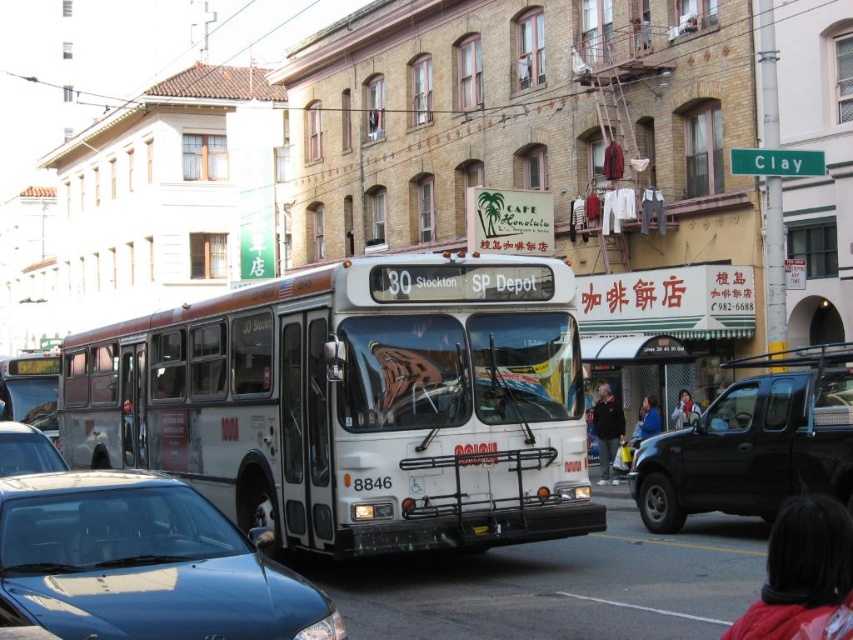
Question: Which object is the closest to the black fabric at lower right?

Choices:
 (A) satin blue sedan at center
 (B) dark gray jacket at center
 (C) blue fabric jacket at lower right

Answer: (A)

Question: Considering the relative positions of black matte truck at center and black plastic license plate at center in the image provided, where is black matte truck at center located with respect to black plastic license plate at center?

Choices:
 (A) left
 (B) right

Answer: (B)

Question: Considering the relative positions of white matte bus at center and blue fabric jacket at lower right in the image provided, where is white matte bus at center located with respect to blue fabric jacket at lower right?

Choices:
 (A) below
 (B) above

Answer: (B)

Question: Does white matte bus at center have a larger size compared to black matte truck at center?

Choices:
 (A) yes
 (B) no

Answer: (A)

Question: Among these points, which one is nearest to the camera?

Choices:
 (A) (611, 435)
 (B) (659, 426)
 (C) (55, 493)
 (D) (844, 557)

Answer: (D)

Question: Among these points, which one is nearest to the camera?

Choices:
 (A) (556, 392)
 (B) (808, 531)
 (C) (636, 435)

Answer: (B)